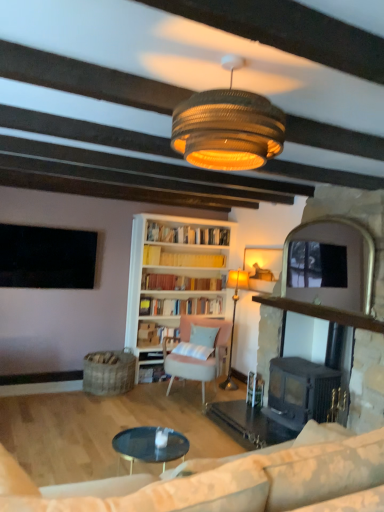
Question: From a real-world perspective, is light blue fabric pillow at center under black cast iron fireplace at center?

Choices:
 (A) yes
 (B) no

Answer: (A)

Question: Does light blue fabric pillow at center lie in front of black cast iron fireplace at center?

Choices:
 (A) no
 (B) yes

Answer: (A)

Question: Considering the relative sizes of light blue fabric pillow at center and black cast iron fireplace at center in the image provided, is light blue fabric pillow at center smaller than black cast iron fireplace at center?

Choices:
 (A) no
 (B) yes

Answer: (B)

Question: Can you confirm if light blue fabric pillow at center is wider than black cast iron fireplace at center?

Choices:
 (A) yes
 (B) no

Answer: (B)

Question: From a real-world perspective, is light blue fabric pillow at center located higher than black cast iron fireplace at center?

Choices:
 (A) yes
 (B) no

Answer: (B)

Question: Does light blue fabric pillow at center have a lesser width compared to black cast iron fireplace at center?

Choices:
 (A) no
 (B) yes

Answer: (B)

Question: Are hardcover books at center, acting as the 2th book starting from the bottom, and hardcover book at center, marked as the third book in a top-to-bottom arrangement, far apart?

Choices:
 (A) yes
 (B) no

Answer: (B)

Question: From a real-world perspective, is hardcover books at center, acting as the 2th book starting from the bottom, under hardcover book at center, which is the first book from bottom to top?

Choices:
 (A) yes
 (B) no

Answer: (B)

Question: Is hardcover books at center, acting as the 2th book starting from the bottom, facing towards hardcover book at center, which is the first book from bottom to top?

Choices:
 (A) yes
 (B) no

Answer: (B)

Question: Does hardcover books at center, acting as the 2th book starting from the bottom, have a larger size compared to hardcover book at center, which is the first book from bottom to top?

Choices:
 (A) no
 (B) yes

Answer: (B)

Question: Considering the relative sizes of hardcover books at center, the second book positioned from the top, and hardcover book at center, which is the first book from bottom to top, in the image provided, is hardcover books at center, the second book positioned from the top, taller than hardcover book at center, which is the first book from bottom to top,?

Choices:
 (A) no
 (B) yes

Answer: (B)

Question: Is hardcover books at center, the second book positioned from the top, oriented away from hardcover book at center, marked as the third book in a top-to-bottom arrangement?

Choices:
 (A) no
 (B) yes

Answer: (A)

Question: Is hardcover book at center, which is the first book from bottom to top, turned away from yellow paperbacks at center, acting as the 1th book starting from the top?

Choices:
 (A) no
 (B) yes

Answer: (A)